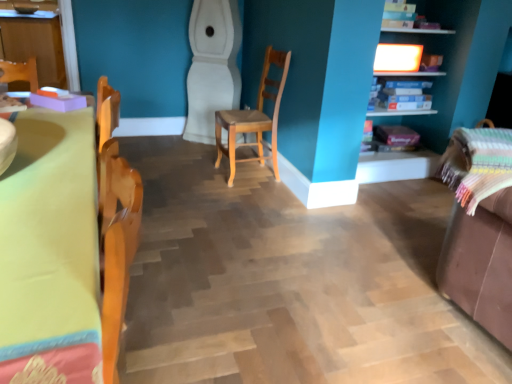
Question: Is matte wooden shelf at upper right, which is the first shelf from top to bottom, thinner than wooden chair at center?

Choices:
 (A) yes
 (B) no

Answer: (B)

Question: Can you confirm if matte wooden shelf at upper right, which is the first shelf from top to bottom, is wider than wooden chair at center?

Choices:
 (A) yes
 (B) no

Answer: (A)

Question: Is matte wooden shelf at upper right, which is counted as the 2th shelf, starting from the bottom, bigger than wooden chair at center?

Choices:
 (A) no
 (B) yes

Answer: (B)

Question: Can we say matte wooden shelf at upper right, which is the first shelf from top to bottom, lies outside wooden chair at center?

Choices:
 (A) no
 (B) yes

Answer: (B)

Question: From the image's perspective, does matte wooden shelf at upper right, which is the first shelf from top to bottom, appear higher than wooden chair at center?

Choices:
 (A) yes
 (B) no

Answer: (A)

Question: From a real-world perspective, is matte wooden shelf at upper right, which is counted as the 2th shelf, starting from the bottom, physically above wooden chair at center?

Choices:
 (A) no
 (B) yes

Answer: (B)

Question: Is the depth of blue cardboard boxes at upper right, which appears as the 1th shelf when ordered from the bottom, greater than that of yellow fabric table at left?

Choices:
 (A) yes
 (B) no

Answer: (A)

Question: Can you confirm if blue cardboard boxes at upper right, which appears as the 2th shelf when viewed from the top, is smaller than yellow fabric table at left?

Choices:
 (A) no
 (B) yes

Answer: (B)

Question: From the image's perspective, is blue cardboard boxes at upper right, which appears as the 1th shelf when ordered from the bottom, beneath yellow fabric table at left?

Choices:
 (A) yes
 (B) no

Answer: (B)

Question: Considering the relative sizes of blue cardboard boxes at upper right, which appears as the 1th shelf when ordered from the bottom, and yellow fabric table at left in the image provided, is blue cardboard boxes at upper right, which appears as the 1th shelf when ordered from the bottom, bigger than yellow fabric table at left?

Choices:
 (A) yes
 (B) no

Answer: (B)

Question: Does blue cardboard boxes at upper right, which appears as the 2th shelf when viewed from the top, have a lesser width compared to yellow fabric table at left?

Choices:
 (A) yes
 (B) no

Answer: (A)

Question: Is blue cardboard boxes at upper right, which appears as the 2th shelf when viewed from the top, oriented away from yellow fabric table at left?

Choices:
 (A) yes
 (B) no

Answer: (B)

Question: Is wooden chair at center oriented away from blue cardboard boxes at upper right, which appears as the 1th shelf when ordered from the bottom?

Choices:
 (A) yes
 (B) no

Answer: (A)